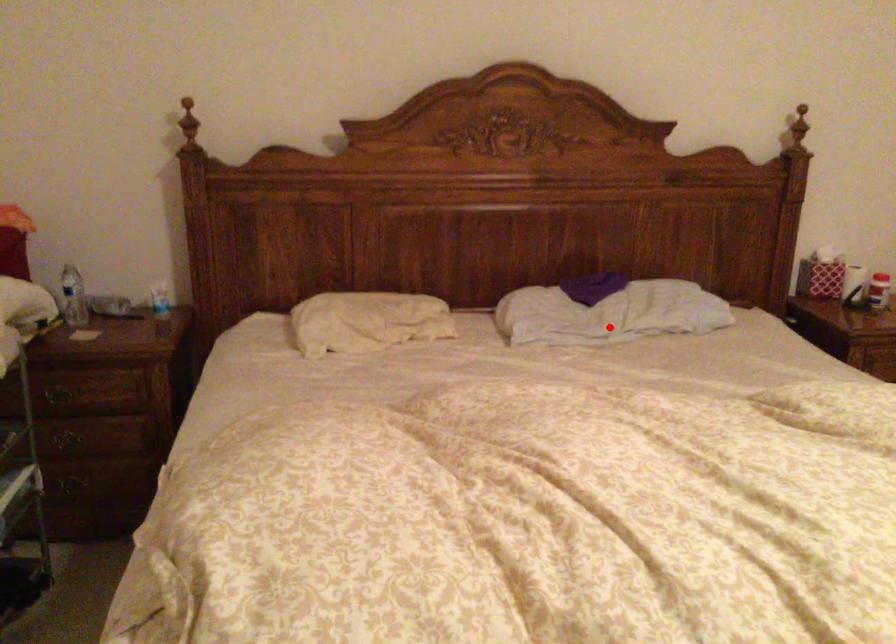
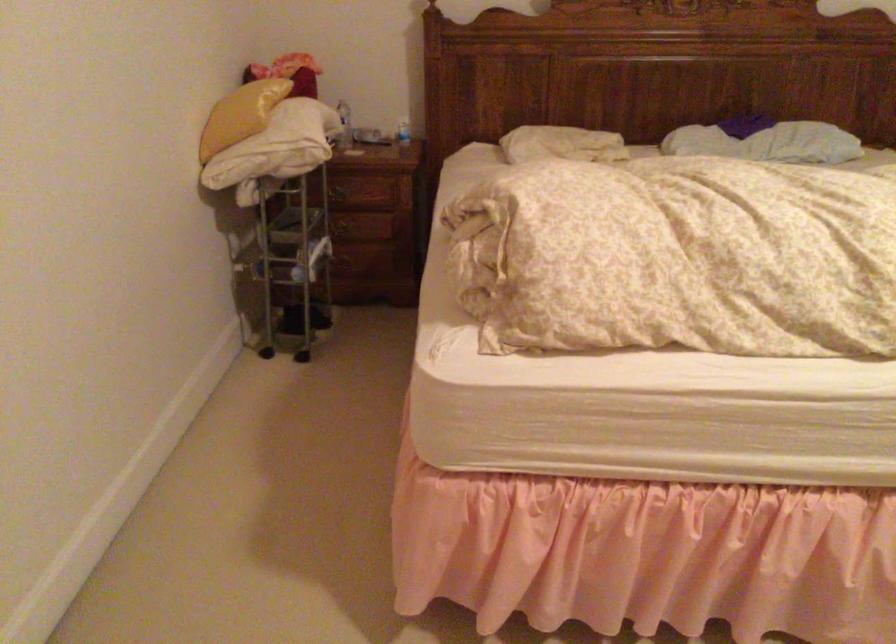
The point at the highlighted location is marked in the first image. Where is the corresponding point in the second image?

(767, 142)